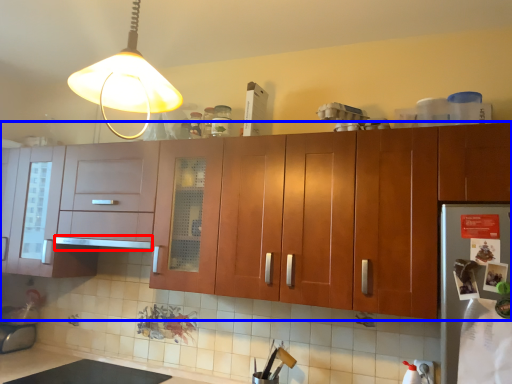
Question: Which point is closer to the camera, exhaust hood (highlighted by a red box) or cabinetry (highlighted by a blue box)?

Choices:
 (A) exhaust hood
 (B) cabinetry

Answer: (B)